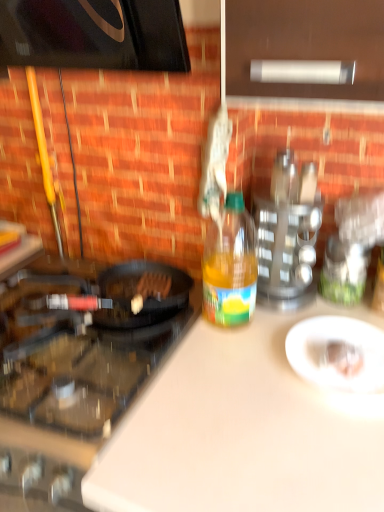
Image resolution: width=384 pixels, height=512 pixels. Identify the location of free location in front of yellow translucent bottle at center. (230, 368).